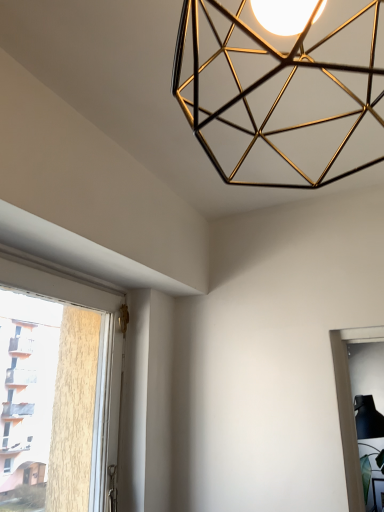
Question: Considering the relative sizes of gold metallic geometric light fixture at upper center and transparent glass window at lower right, which is the 2th window from front to back, in the image provided, is gold metallic geometric light fixture at upper center taller than transparent glass window at lower right, which is the 2th window from front to back,?

Choices:
 (A) no
 (B) yes

Answer: (A)

Question: From the image's perspective, does gold metallic geometric light fixture at upper center appear lower than transparent glass window at lower right, which is the 1th window in right-to-left order?

Choices:
 (A) yes
 (B) no

Answer: (B)

Question: From a real-world perspective, does gold metallic geometric light fixture at upper center sit lower than transparent glass window at lower right, the 1th window positioned from the bottom?

Choices:
 (A) no
 (B) yes

Answer: (A)

Question: Does gold metallic geometric light fixture at upper center have a greater width compared to transparent glass window at lower right, which is counted as the 2th window, starting from the top?

Choices:
 (A) no
 (B) yes

Answer: (A)

Question: Is transparent glass window at lower right, which is the second window in left-to-right order, located within gold metallic geometric light fixture at upper center?

Choices:
 (A) yes
 (B) no

Answer: (B)

Question: Is gold metallic geometric light fixture at upper center facing towards transparent glass window at lower right, which is the 1th window in right-to-left order?

Choices:
 (A) yes
 (B) no

Answer: (A)

Question: Is white plastic window at left, placed as the second window when sorted from back to front, far from gold metallic geometric light fixture at upper center?

Choices:
 (A) no
 (B) yes

Answer: (A)

Question: Considering the relative positions of white plastic window at left, the 2th window when ordered from bottom to top, and gold metallic geometric light fixture at upper center in the image provided, is white plastic window at left, the 2th window when ordered from bottom to top, in front of gold metallic geometric light fixture at upper center?

Choices:
 (A) no
 (B) yes

Answer: (A)

Question: Is gold metallic geometric light fixture at upper center located within white plastic window at left, the 2th window when ordered from bottom to top?

Choices:
 (A) yes
 (B) no

Answer: (B)

Question: Is white plastic window at left, the 2th window from the right, at the left side of gold metallic geometric light fixture at upper center?

Choices:
 (A) no
 (B) yes

Answer: (B)

Question: Does white plastic window at left, arranged as the 1th window when viewed from the left, have a greater width compared to gold metallic geometric light fixture at upper center?

Choices:
 (A) yes
 (B) no

Answer: (B)

Question: Does white plastic window at left, the 2th window from the right, have a lesser height compared to gold metallic geometric light fixture at upper center?

Choices:
 (A) no
 (B) yes

Answer: (A)

Question: Considering the relative sizes of transparent glass window at lower right, the 1th window positioned from the bottom, and gold metallic geometric light fixture at upper center in the image provided, is transparent glass window at lower right, the 1th window positioned from the bottom, smaller than gold metallic geometric light fixture at upper center?

Choices:
 (A) no
 (B) yes

Answer: (A)